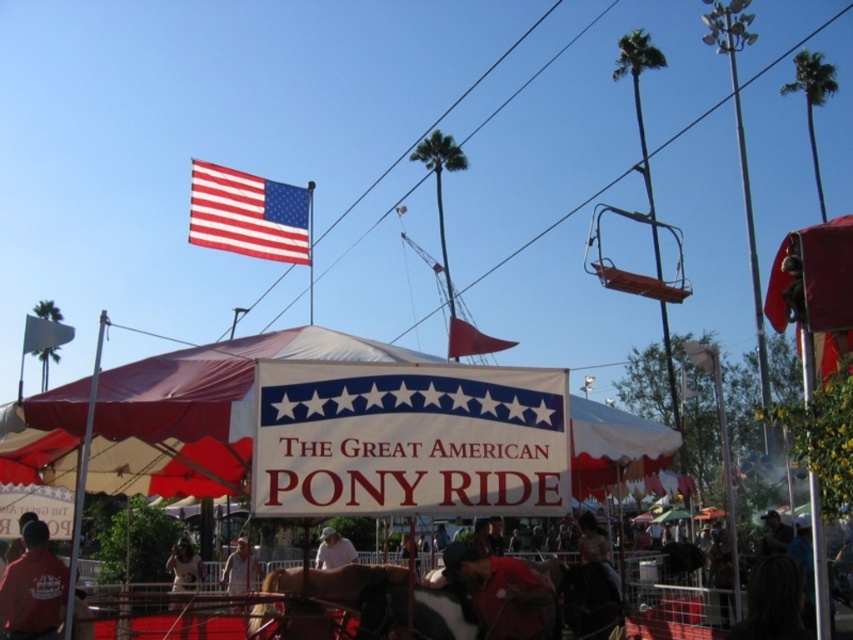
Which is more to the left, white fabric sign at center or red-white-and-blue fabric flag at upper center?

From the viewer's perspective, red-white-and-blue fabric flag at upper center appears more on the left side.

The width and height of the screenshot is (853, 640). What do you see at coordinates (409, 440) in the screenshot?
I see `white fabric sign at center` at bounding box center [409, 440].

Is point (563, 371) closer to viewer compared to point (223, 198)?

That is True.

Locate an element on the screen. The image size is (853, 640). white fabric sign at center is located at coordinates (409, 440).

Find the location of a particular element. This screenshot has height=640, width=853. white fabric sign at center is located at coordinates (409, 440).

Which of these two, white fabric sign at center or light brown leather jacket at center, stands taller?

Standing taller between the two is light brown leather jacket at center.

Does point (389, 484) come closer to viewer compared to point (334, 561)?

Yes, it is in front of point (334, 561).

The height and width of the screenshot is (640, 853). What are the coordinates of `white fabric sign at center` in the screenshot? It's located at (409, 440).

Does point (482, 598) come in front of point (785, 525)?

That is True.

Between point (498, 577) and point (764, 525), which one is positioned behind?

The point (764, 525) is more distant.

Does point (480, 596) lie behind point (763, 550)?

No.

The image size is (853, 640). I want to click on red cotton shirt at center, so click(502, 593).